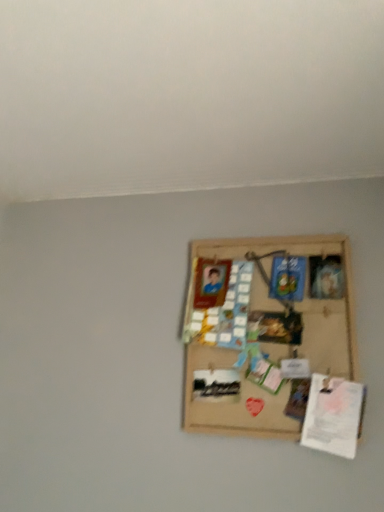
Question: Is burlap board at center wider or thinner than white paper at lower right?

Choices:
 (A) thin
 (B) wide

Answer: (A)

Question: Is point (193, 265) closer or farther from the camera than point (314, 394)?

Choices:
 (A) closer
 (B) farther

Answer: (B)

Question: Would you say burlap board at center is to the left or to the right of white paper at lower right in the picture?

Choices:
 (A) right
 (B) left

Answer: (B)

Question: From a real-world perspective, is white paper at lower right physically located above or below burlap board at center?

Choices:
 (A) below
 (B) above

Answer: (A)

Question: Visually, is white paper at lower right positioned to the left or to the right of burlap board at center?

Choices:
 (A) right
 (B) left

Answer: (A)

Question: In terms of size, does white paper at lower right appear bigger or smaller than burlap board at center?

Choices:
 (A) big
 (B) small

Answer: (B)

Question: Does point (309, 387) appear closer or farther from the camera than point (193, 344)?

Choices:
 (A) farther
 (B) closer

Answer: (B)